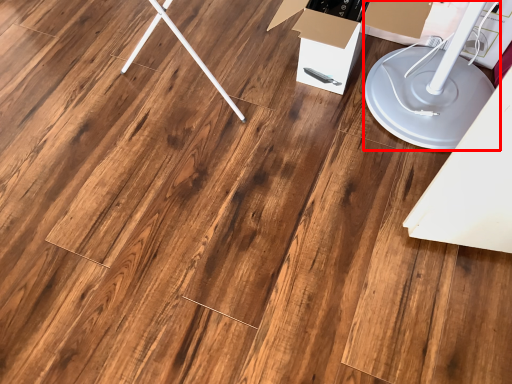
Question: From the image's perspective, where is lift (annotated by the red box) located in relation to cardboard box in the image?

Choices:
 (A) below
 (B) above

Answer: (A)